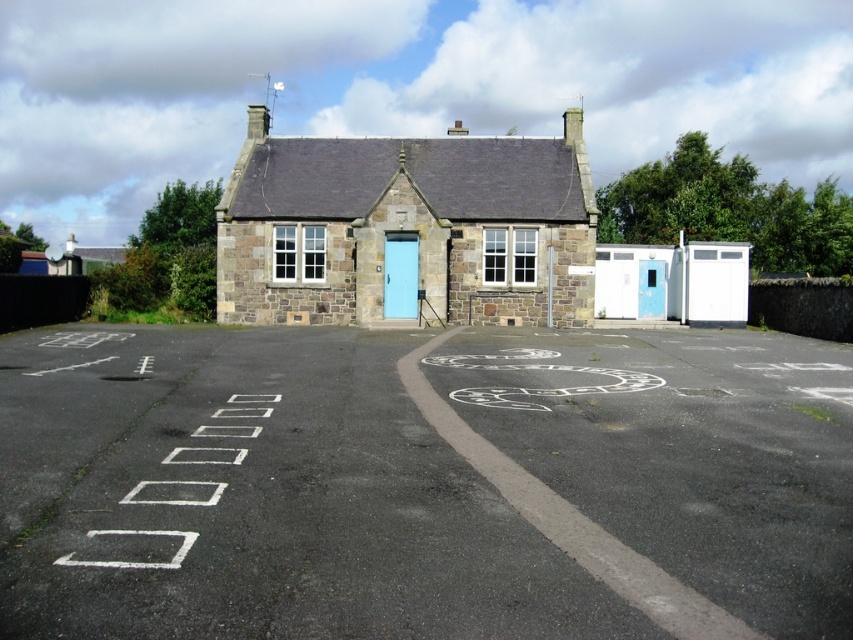
Question: Among these points, which one is farthest from the camera?

Choices:
 (A) (405, 304)
 (B) (187, 451)

Answer: (A)

Question: Is white asphalt parking lot at center smaller than light blue wooden door at center?

Choices:
 (A) yes
 (B) no

Answer: (B)

Question: Where is white asphalt parking lot at center located in relation to light blue wooden door at center in the image?

Choices:
 (A) below
 (B) above

Answer: (A)

Question: Does white asphalt parking lot at center appear over light blue wooden door at center?

Choices:
 (A) yes
 (B) no

Answer: (B)

Question: Among these objects, which one is nearest to the camera?

Choices:
 (A) white asphalt parking lot at center
 (B) light blue wooden door at center

Answer: (A)

Question: Which point is closer to the camera?

Choices:
 (A) light blue wooden door at center
 (B) white asphalt parking lot at center

Answer: (B)